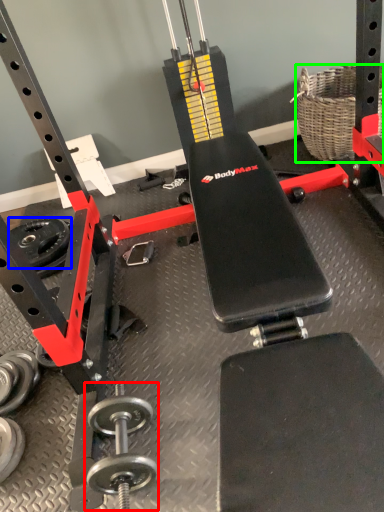
Question: Considering the real-world distances, which object is closest to dumbbell (highlighted by a red box)? wheel (highlighted by a blue box) or basket (highlighted by a green box).

Choices:
 (A) wheel
 (B) basket

Answer: (A)